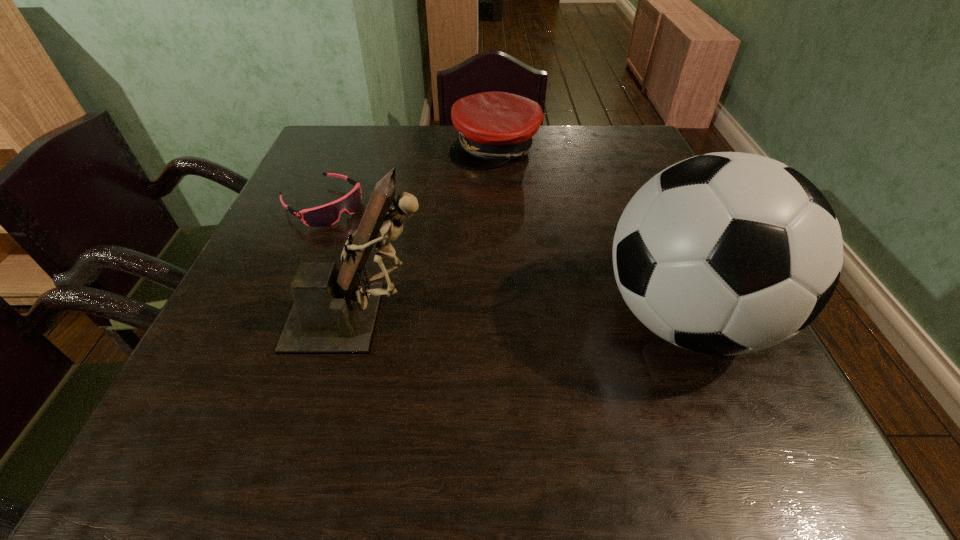
Identify the location of vacant space on the desktop that is between the figurine and the soccer ball and is positioned at the front of the third object from left to right where the visor is located. The height and width of the screenshot is (540, 960). (481, 318).

Where is `vacant spot on the desktop that is between the figurine and the soccer ball and is positioned on the front-facing side of the third nearest object`? This screenshot has height=540, width=960. vacant spot on the desktop that is between the figurine and the soccer ball and is positioned on the front-facing side of the third nearest object is located at coordinates (478, 318).